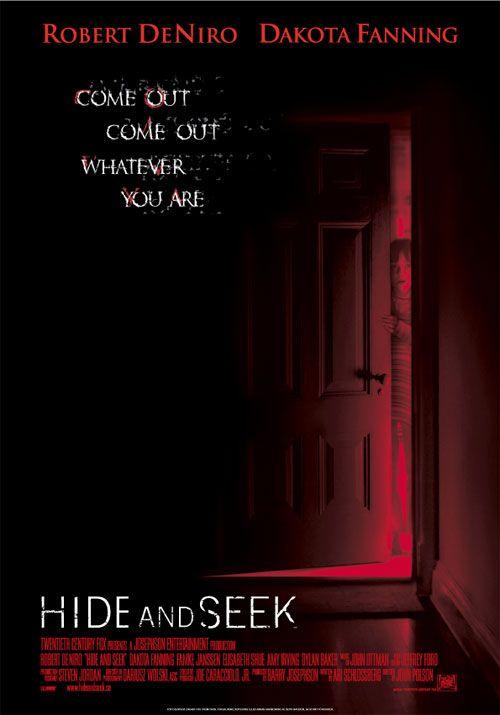
You are a GUI agent. You are given a task and a screenshot of the screen. Output one action in this format:
    pyautogui.click(x=<x>, y=<y>)
    Task: Click on the door
    The image size is (500, 715).
    Given the screenshot: What is the action you would take?
    pyautogui.click(x=333, y=304)